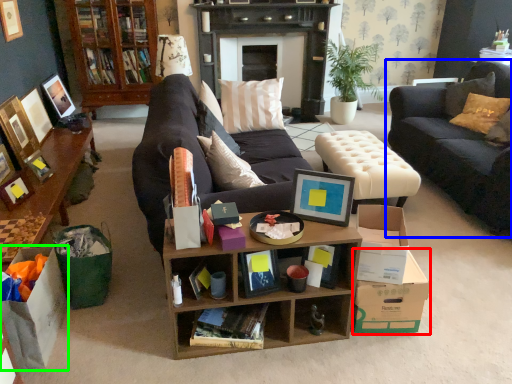
Question: Based on their relative distances, which object is farther from cardboard box (highlighted by a red box)? Choose from studio couch (highlighted by a blue box) and cardboard box (highlighted by a green box).

Choices:
 (A) studio couch
 (B) cardboard box

Answer: (B)